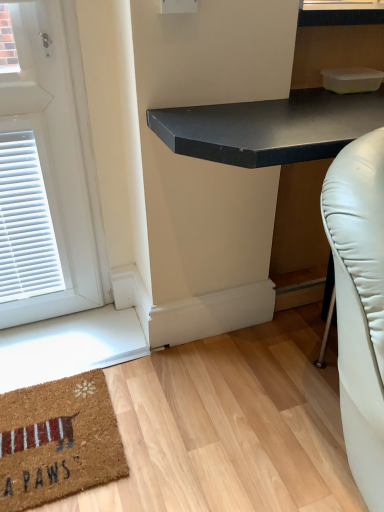
I want to click on empty space that is to the right of brown coir mat at lower left, so click(172, 424).